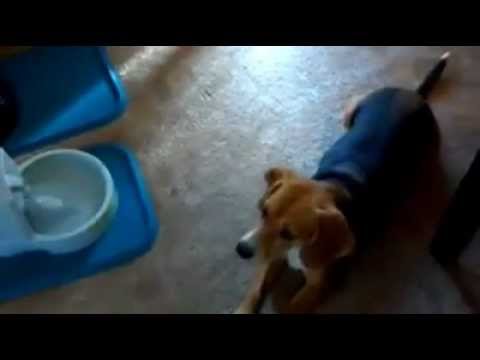
At what (x,y) coordinates should I click in order to perform the action: click on water bowl. Please return your answer as a coordinate pair (x, y). Image resolution: width=480 pixels, height=360 pixels. Looking at the image, I should click on (84, 205).